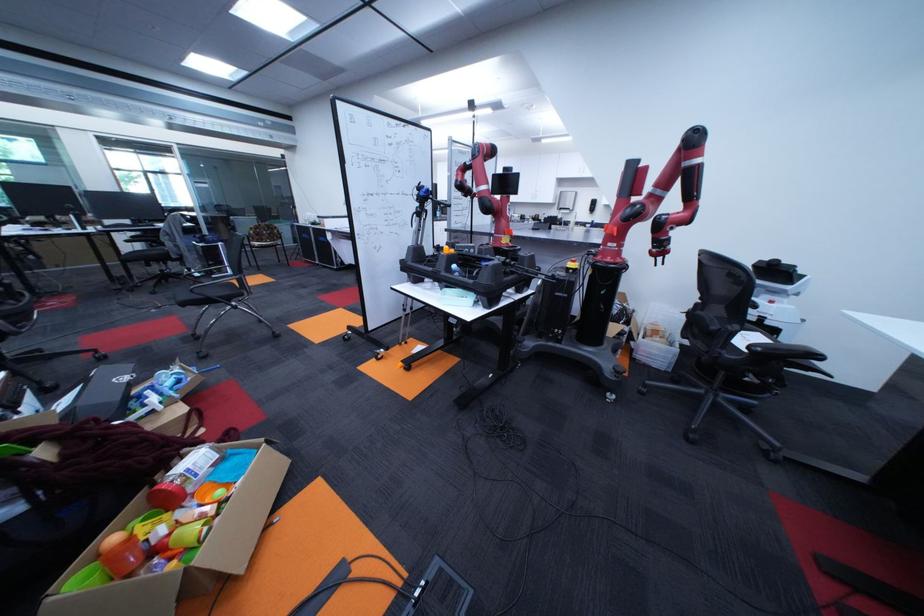
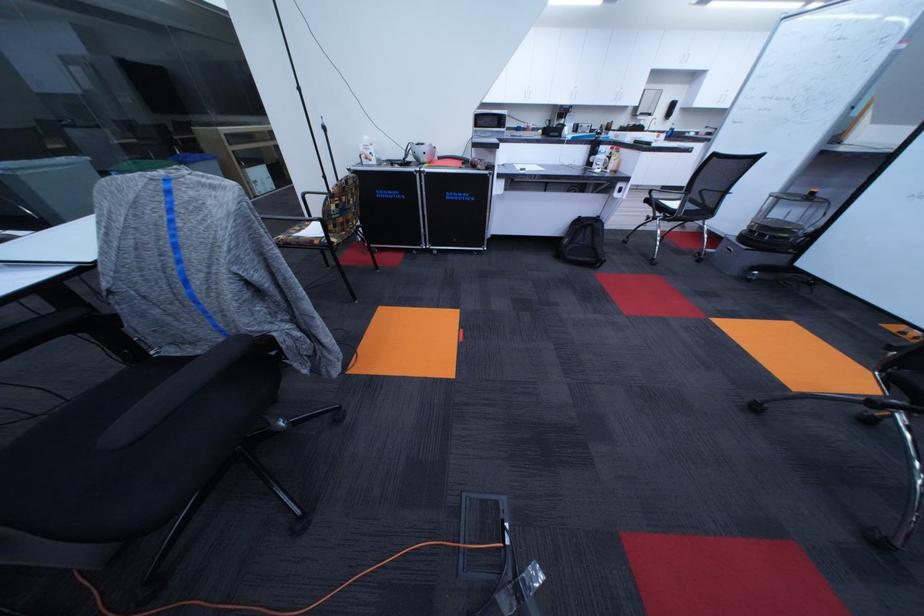
In the second image, find the point that corresponds to (272,235) in the first image.

(356, 209)